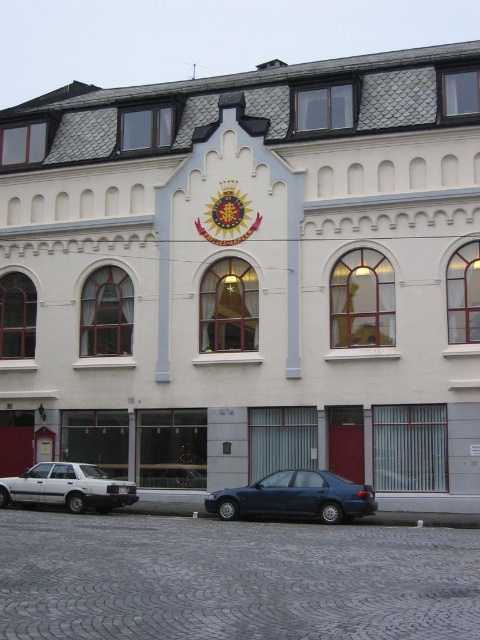
Which is more to the right, dark blue sedan at center or white matte sedan at lower left?

dark blue sedan at center

Does dark blue sedan at center have a larger size compared to white matte sedan at lower left?

No, dark blue sedan at center is not bigger than white matte sedan at lower left.

Between point (303, 474) and point (68, 483), which one is positioned in front?

Positioned in front is point (303, 474).

At what (x,y) coordinates should I click in order to perform the action: click on dark blue sedan at center. Please return your answer as a coordinate pair (x, y). Looking at the image, I should click on (295, 497).